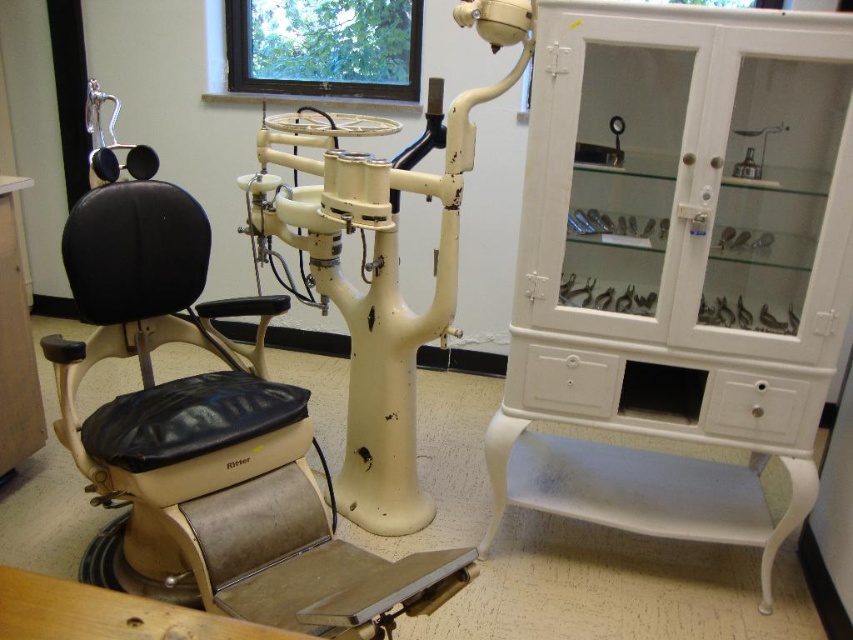
In the scene shown: Is white glossy cabinet at right positioned before matte cream dental chair at center?

That is True.

Can you confirm if white glossy cabinet at right is positioned below matte cream dental chair at center?

Correct, white glossy cabinet at right is located below matte cream dental chair at center.

Is point (848, 56) more distant than point (392, 186)?

That is False.

The width and height of the screenshot is (853, 640). Identify the location of white glossy cabinet at right. (677, 266).

Is white glossy cabinet at right thinner than black leather swivel chair at left?

In fact, white glossy cabinet at right might be wider than black leather swivel chair at left.

In the scene shown: Is the position of white glossy cabinet at right more distant than that of black leather swivel chair at left?

No, it is not.

Identify the location of white glossy cabinet at right. This screenshot has width=853, height=640. (677, 266).

Which is more to the right, black leather swivel chair at left or matte cream dental chair at center?

From the viewer's perspective, matte cream dental chair at center appears more on the right side.

Which of these two, black leather swivel chair at left or matte cream dental chair at center, stands shorter?

black leather swivel chair at left is shorter.

Describe the element at coordinates (171, 394) in the screenshot. The image size is (853, 640). I see `black leather swivel chair at left` at that location.

Where is `black leather swivel chair at left`? The image size is (853, 640). black leather swivel chair at left is located at coordinates (171, 394).